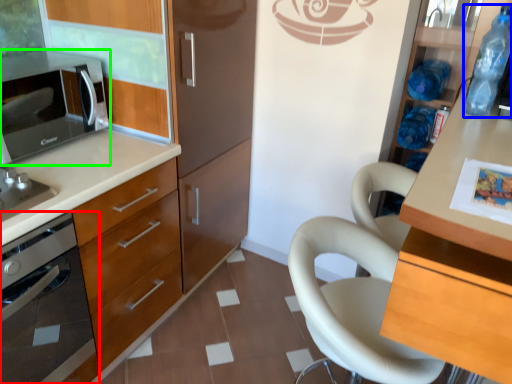
Question: Estimate the real-world distances between objects in this image. Which object is farther from home appliance (highlighted by a red box), bottle (highlighted by a blue box) or microwave oven (highlighted by a green box)?

Choices:
 (A) bottle
 (B) microwave oven

Answer: (A)